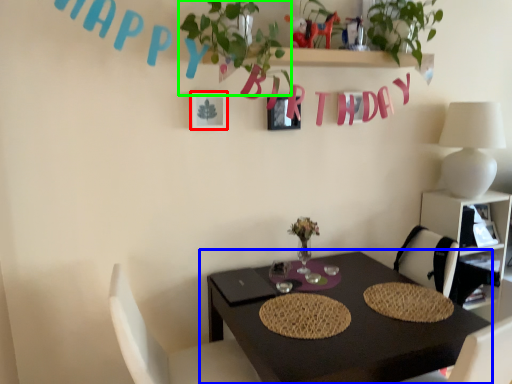
Question: Estimate the real-world distances between objects in this image. Which object is farther from picture frame (highlighted by a red box), table (highlighted by a blue box) or plant (highlighted by a green box)?

Choices:
 (A) table
 (B) plant

Answer: (A)